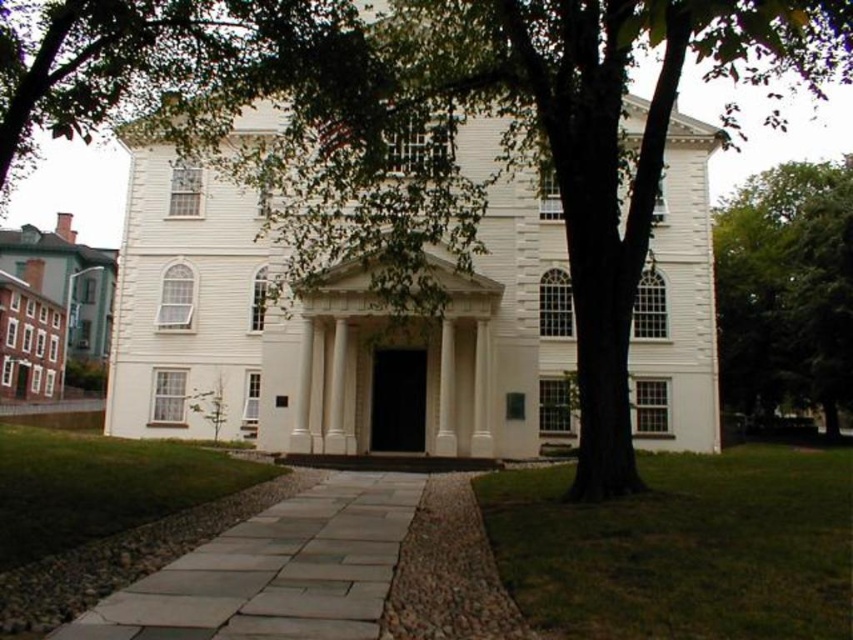
You are a delivery person trying to drive a van that is 2 meters wide to the entrance of the building. The gray stone pathway at center is the only path available. Can the van pass through the pathway without touching the green leafy tree at right?

The gray stone pathway at center has a lesser width compared to green leafy tree at right, meaning the pathway is narrower than the tree. Since the van is 2 meters wide, it may not fit if the pathway is too narrow. However, the description only states the pathway is narrower than the tree, but does not provide exact measurements. Without knowing the exact width of the pathway, it is uncertain if the van can pass safely.